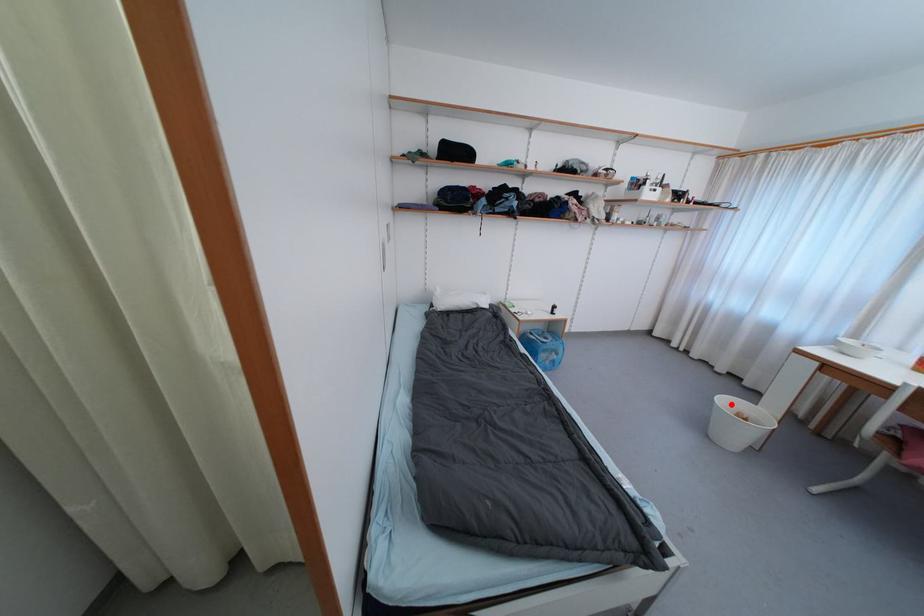
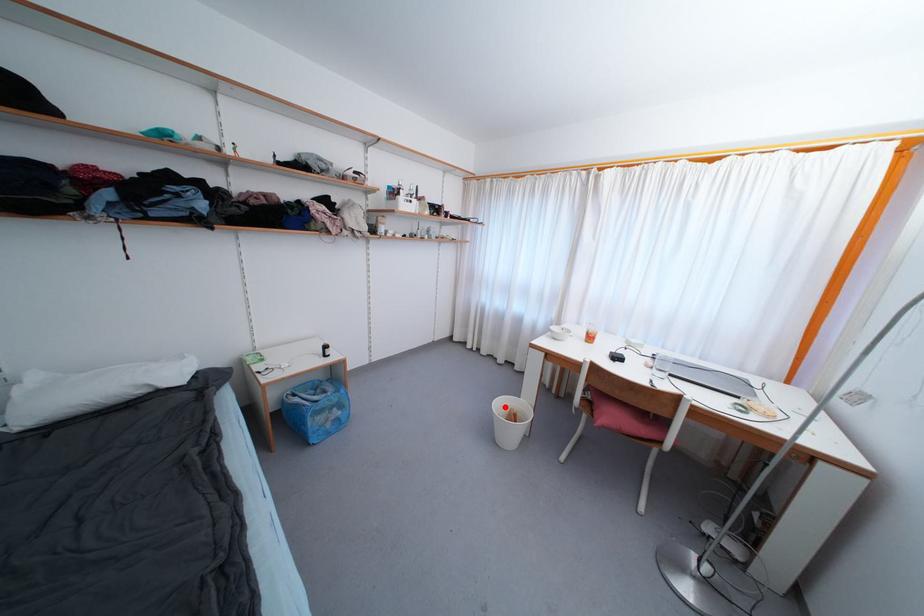
I am providing you with two images of the same scene from different viewpoints. A red point is marked on the first image and another point is marked on the second image. Do the highlighted points in image1 and image2 indicate the same real-world spot?

Yes